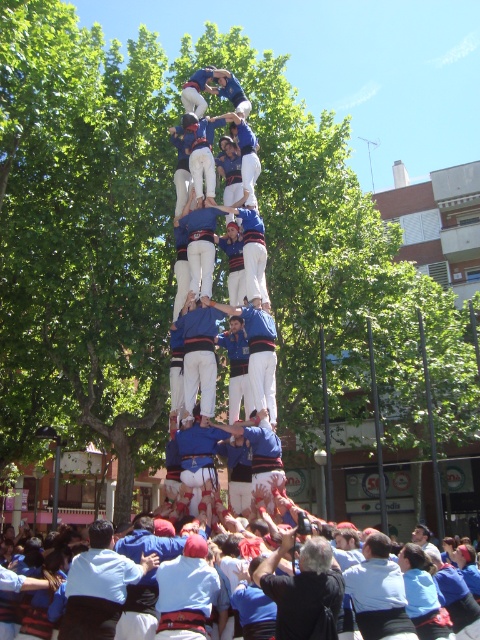
Question: Which of the following is the farthest from the observer?

Choices:
 (A) (178, 621)
 (B) (272, 340)

Answer: (B)

Question: In this image, where is blue shirt at center located relative to blue cotton shirt at center?

Choices:
 (A) right
 (B) left

Answer: (A)

Question: Based on their relative distances, which object is nearer to the blue fabric shirt at center?

Choices:
 (A) blue cotton shirt at center
 (B) dark blue shirt at center

Answer: (B)

Question: Is dark blue shirt at center positioned before blue shirt at center?

Choices:
 (A) yes
 (B) no

Answer: (A)

Question: Does dark blue shirt at center appear on the right side of blue shirt at center?

Choices:
 (A) yes
 (B) no

Answer: (B)

Question: Estimate the real-world distances between objects in this image. Which object is farther from the dark blue shirt at center?

Choices:
 (A) blue cotton shirt at center
 (B) blue cotton shirt at lower left

Answer: (A)